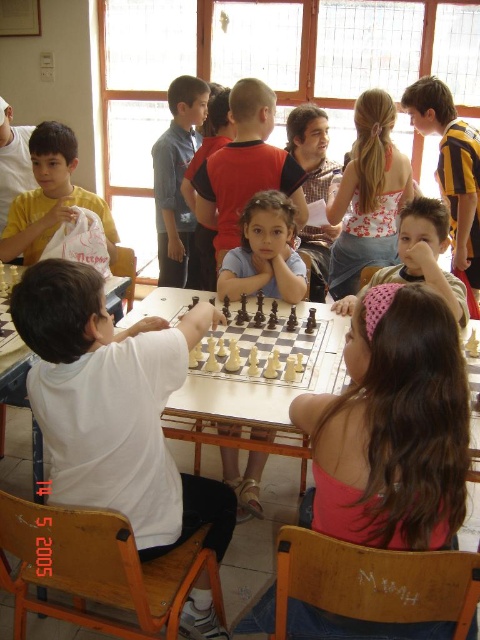
You are a photographer standing in front of the classroom. You notice the blue cotton shirt at center and the matte white bag at left. Which object is positioned lower from the ground?

The blue cotton shirt at center is below matte white bag at left, so the blue cotton shirt at center is positioned lower from the ground.

You are a photographer trying to capture the chess game scene. You notice a specific point at coordinates (115,406) in the image. Based on the scene description, what object or part of the scene is located at that point?

The point at coordinates (115,406) is located on the white matte shirt at center.